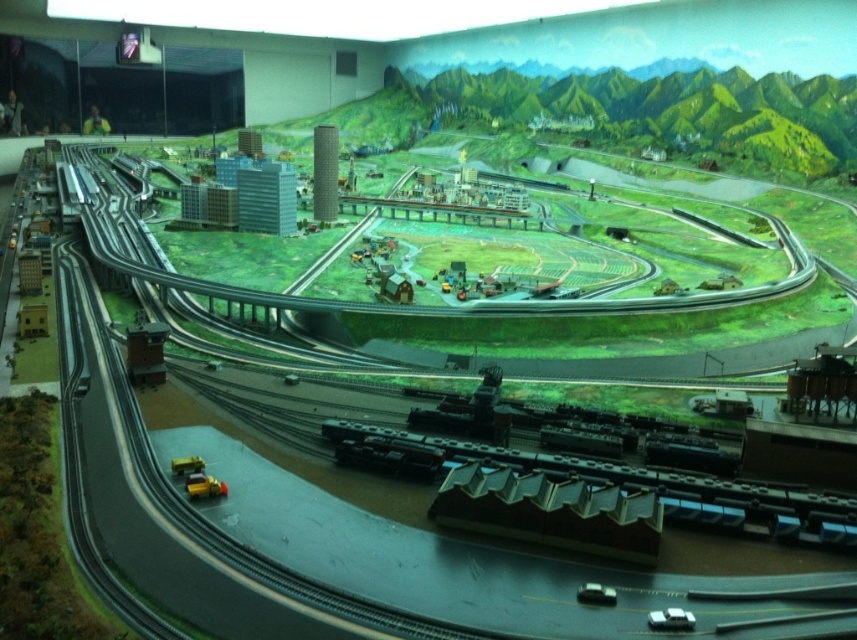
You are a model railway enthusiast examining the setup. There is a yellow plastic car at lower left. Can you determine its exact position within the display case using coordinates?

The yellow plastic car at lower left is located at point coordinates (204, 484).

You are a visitor standing in front of the model railway display. You notice a yellow plastic car at lower left and a metallic yellow truck at lower left. Which one appears nearer to you?

The yellow plastic car at lower left is closer to the viewer than the metallic yellow truck at lower left, so the yellow plastic car at lower left appears nearer.

From the picture: You are a model train enthusiast observing the display. You notice the metallic gray train track at center and the shiny silver train at bottom right. Which object is positioned closer to the right side of the display?

The shiny silver train at bottom right is positioned closer to the right side of the display because the metallic gray train track at center is to its left.